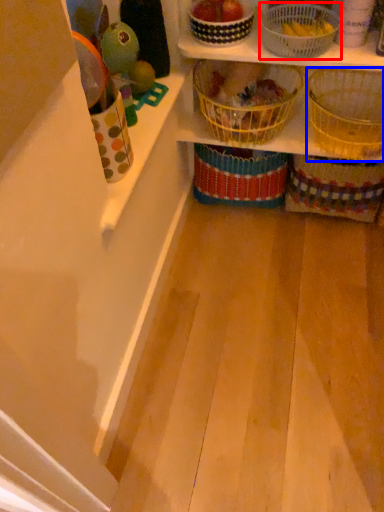
Question: Among these objects, which one is farthest to the camera, basket (highlighted by a red box) or basket (highlighted by a blue box)?

Choices:
 (A) basket
 (B) basket

Answer: (B)